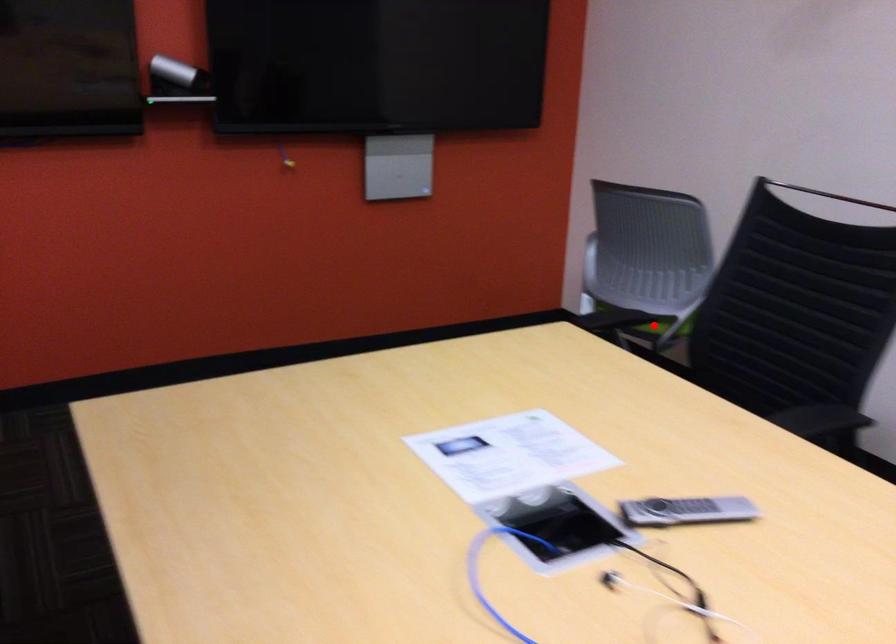
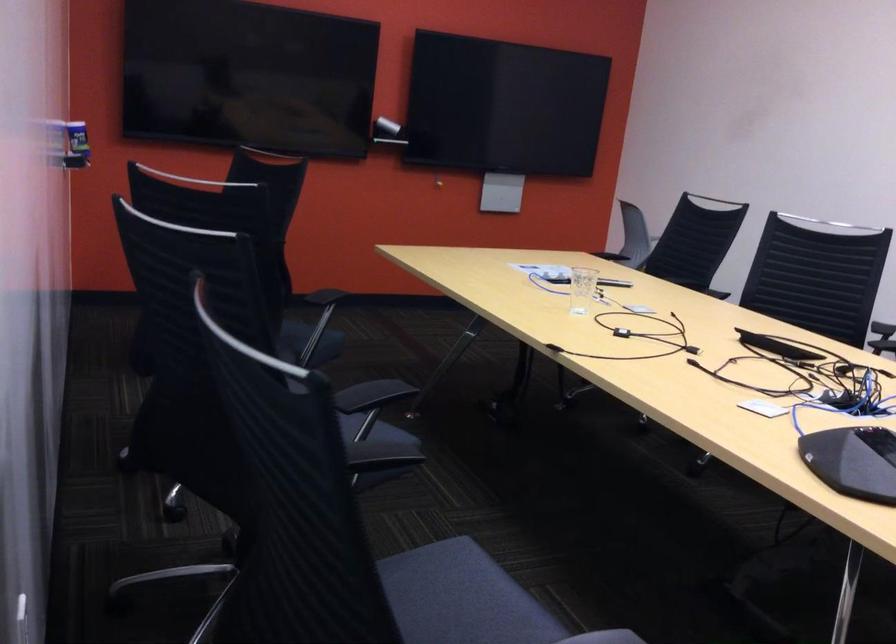
Question: I am providing you with two images of the same scene from different viewpoints. A red point is marked on the first image. Can you still see the location of the red point in image 2?

Choices:
 (A) Yes
 (B) No

Answer: (B)